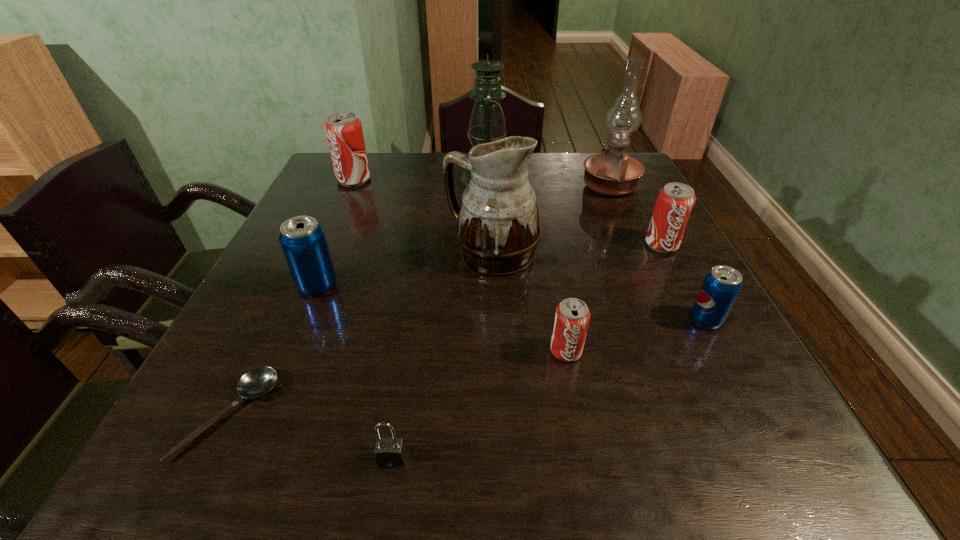
You are a GUI agent. You are given a task and a screenshot of the screen. Output one action in this format:
    pyautogui.click(x=<x>, y=<y>)
    Task: Click on the nearer blue pop soda
    The width and height of the screenshot is (960, 540).
    Given the screenshot: What is the action you would take?
    pyautogui.click(x=721, y=286)

The height and width of the screenshot is (540, 960). Identify the location of the fourth nearest object. (721, 286).

Where is `the smallest pink soda can`? the smallest pink soda can is located at coordinates (572, 316).

You are a GUI agent. You are given a task and a screenshot of the screen. Output one action in this format:
    pyautogui.click(x=<x>, y=<y>)
    Task: Click on the nearest soda can
    The image size is (960, 540).
    Given the screenshot: What is the action you would take?
    pyautogui.click(x=572, y=316)

Locate an element on the screen. The height and width of the screenshot is (540, 960). gray padlock is located at coordinates (389, 452).

You are a GUI agent. You are given a task and a screenshot of the screen. Output one action in this format:
    pyautogui.click(x=<x>, y=<y>)
    Task: Click on the ninth tallest object
    This screenshot has width=960, height=540.
    Given the screenshot: What is the action you would take?
    pyautogui.click(x=389, y=452)

This screenshot has height=540, width=960. What are the coordinates of `the shortest object` in the screenshot? It's located at (258, 381).

What are the coordinates of `ladle` in the screenshot? It's located at (258, 381).

Locate an element on the screen. Image resolution: width=960 pixels, height=540 pixels. vacant region located 0.140m on the front of the left oil lamp is located at coordinates (488, 222).

You are a GUI agent. You are given a task and a screenshot of the screen. Output one action in this format:
    pyautogui.click(x=<x>, y=<y>)
    Task: Click on the vacant area situated on the left of the right oil lamp
    The width and height of the screenshot is (960, 540).
    Given the screenshot: What is the action you would take?
    pyautogui.click(x=444, y=186)